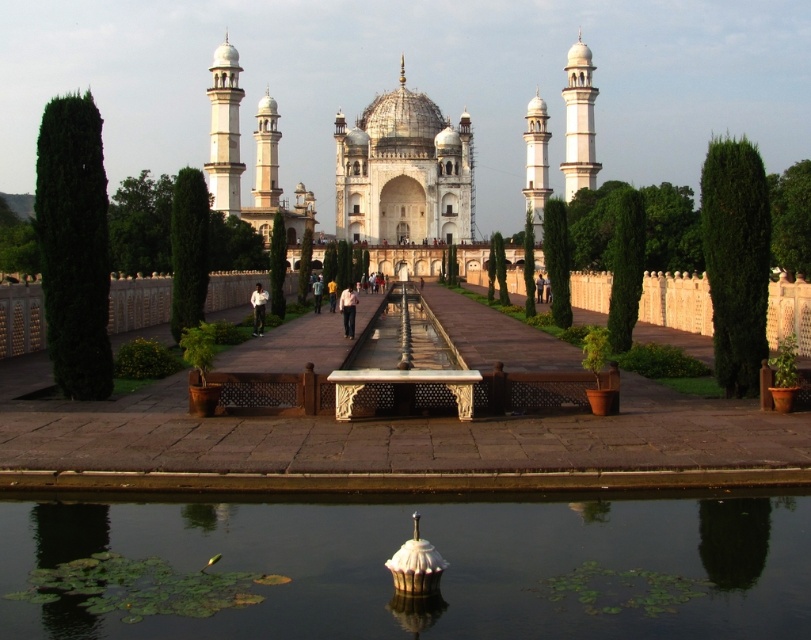
Question: Among these objects, which one is nearest to the camera?

Choices:
 (A) transparent glass water at center
 (B) white marble palace at center

Answer: (A)

Question: Is transparent glass water at center to the left of white marble palace at center from the viewer's perspective?

Choices:
 (A) no
 (B) yes

Answer: (A)

Question: Among these objects, which one is nearest to the camera?

Choices:
 (A) transparent glass water at center
 (B) white marble palace at center

Answer: (A)

Question: Among these objects, which one is farthest from the camera?

Choices:
 (A) white marble palace at center
 (B) transparent glass water at center

Answer: (A)

Question: Can you confirm if transparent glass water at center is positioned to the left of white marble palace at center?

Choices:
 (A) yes
 (B) no

Answer: (B)

Question: Does transparent glass water at center appear on the left side of white marble palace at center?

Choices:
 (A) yes
 (B) no

Answer: (B)